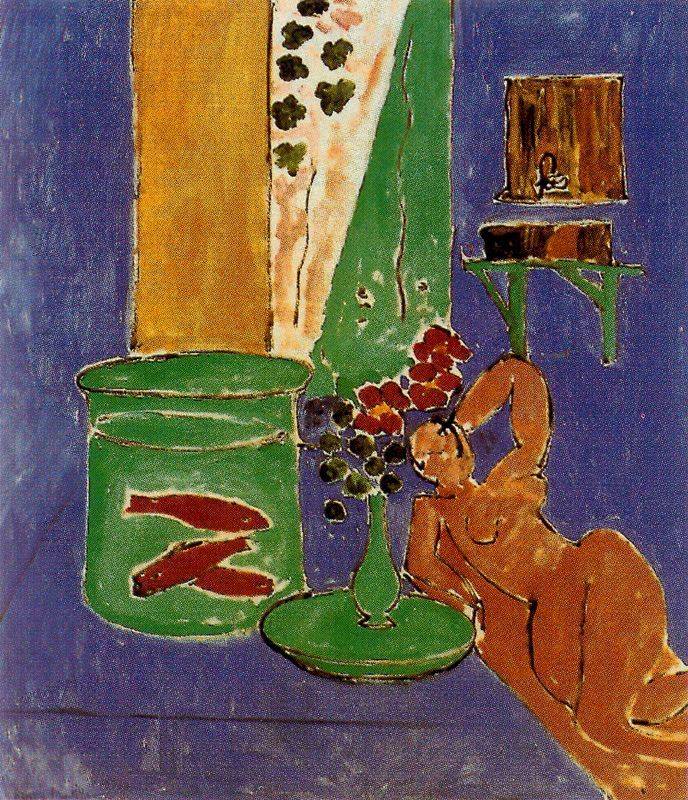
This screenshot has width=688, height=800. What are the coordinates of `brown frame` in the screenshot? It's located at (583, 126).